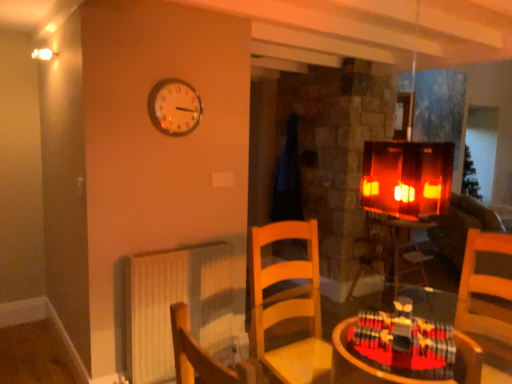
Question: Is velvet brown couch at right oriented away from metallic round clock at upper center?

Choices:
 (A) no
 (B) yes

Answer: (A)

Question: Is velvet brown couch at right at the right side of metallic round clock at upper center?

Choices:
 (A) yes
 (B) no

Answer: (A)

Question: Can you confirm if velvet brown couch at right is bigger than metallic round clock at upper center?

Choices:
 (A) no
 (B) yes

Answer: (B)

Question: From a real-world perspective, does velvet brown couch at right stand above metallic round clock at upper center?

Choices:
 (A) yes
 (B) no

Answer: (B)

Question: Is velvet brown couch at right in contact with metallic round clock at upper center?

Choices:
 (A) yes
 (B) no

Answer: (B)

Question: From a real-world perspective, is velvet brown couch at right located beneath metallic round clock at upper center?

Choices:
 (A) no
 (B) yes

Answer: (B)

Question: Considering the relative sizes of wooden table at lower right, the second table viewed from the right, and velvet brown couch at right in the image provided, is wooden table at lower right, the second table viewed from the right, wider than velvet brown couch at right?

Choices:
 (A) yes
 (B) no

Answer: (B)

Question: Does wooden table at lower right, which is the second table in back-to-front order, appear on the right side of velvet brown couch at right?

Choices:
 (A) no
 (B) yes

Answer: (A)

Question: Is there a large distance between wooden table at lower right, the 2th table in the bottom-to-top sequence, and velvet brown couch at right?

Choices:
 (A) no
 (B) yes

Answer: (B)

Question: Is velvet brown couch at right a part of wooden table at lower right, acting as the 1th table starting from the top?

Choices:
 (A) yes
 (B) no

Answer: (B)

Question: Is wooden table at lower right, the 2th table in the bottom-to-top sequence, aimed at velvet brown couch at right?

Choices:
 (A) yes
 (B) no

Answer: (A)

Question: From the image's perspective, is wooden table at lower right, which is counted as the first table, starting from the front, under velvet brown couch at right?

Choices:
 (A) no
 (B) yes

Answer: (A)

Question: From a real-world perspective, is wooden table at center, placed as the 2th table when sorted from front to back, below velvet brown couch at right?

Choices:
 (A) no
 (B) yes

Answer: (A)